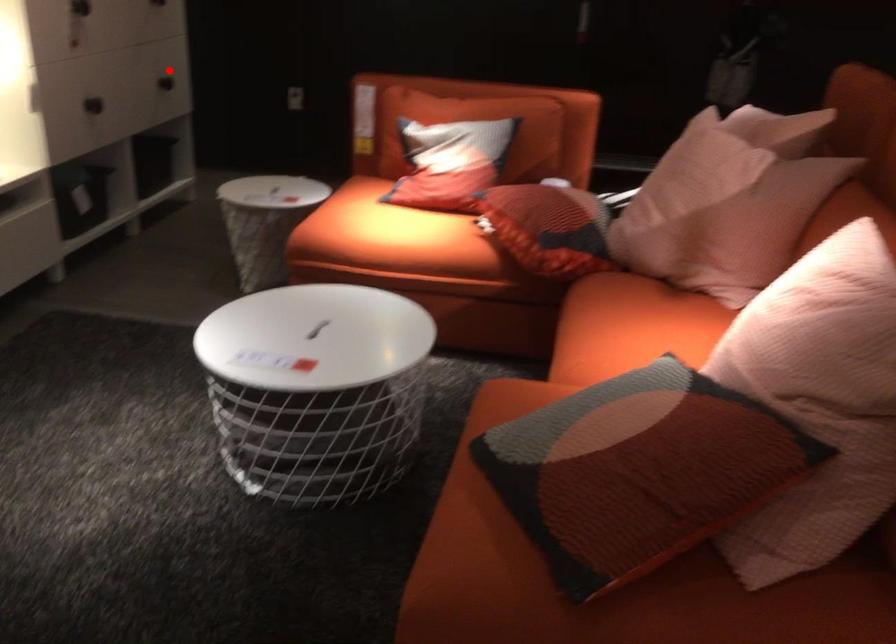
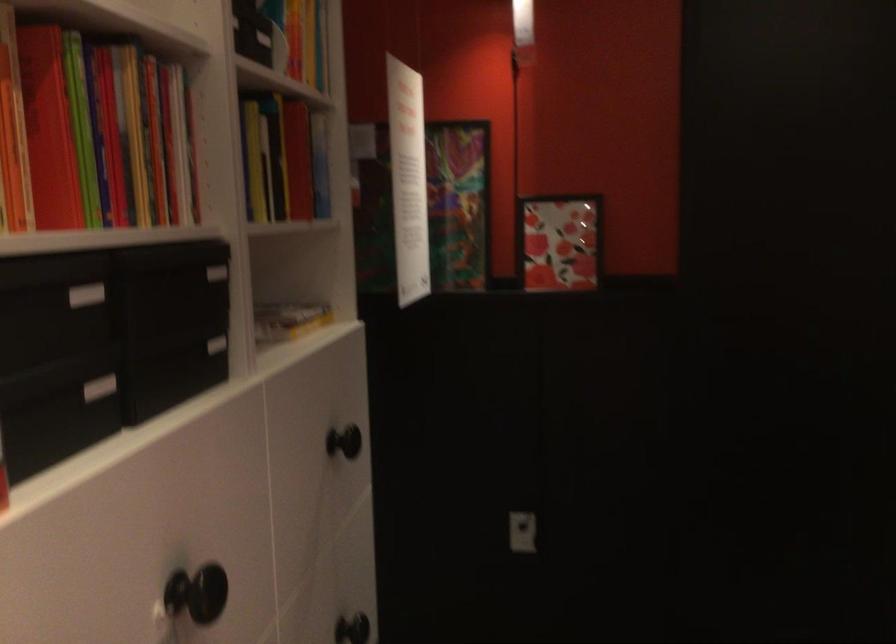
Question: I am providing you with two images of the same scene from different viewpoints. A red point is shown in image1. For the corresponding object point in image2, is it positioned nearer or farther from the camera?

Choices:
 (A) Nearer
 (B) Farther

Answer: (A)